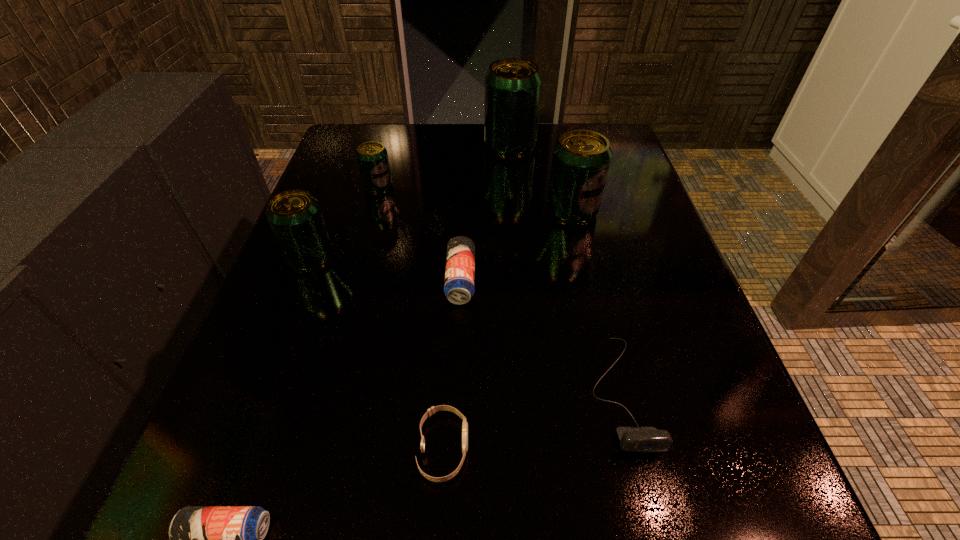
Identify the location of object located in the near edge section of the desktop. The width and height of the screenshot is (960, 540). (430, 412).

Image resolution: width=960 pixels, height=540 pixels. What are the coordinates of `beer can positioned at the right edge` in the screenshot? It's located at (x=581, y=158).

You are a GUI agent. You are given a task and a screenshot of the screen. Output one action in this format:
    pyautogui.click(x=<x>, y=<y>)
    Task: Click on the webcam that is at the right edge
    
    Given the screenshot: What is the action you would take?
    pyautogui.click(x=645, y=439)

Locate an element on the screen. This screenshot has height=540, width=960. free space at the far edge of the desktop is located at coordinates (407, 144).

Locate an element on the screen. Image resolution: width=960 pixels, height=540 pixels. blank space at the near edge of the desktop is located at coordinates (337, 491).

Where is `vacant space at the left edge of the desktop`? vacant space at the left edge of the desktop is located at coordinates (316, 347).

The height and width of the screenshot is (540, 960). I want to click on vacant space at the right edge, so click(616, 346).

At what (x,y) coordinates should I click in order to perform the action: click on vacant space at the far right corner. Please return your answer as a coordinate pair (x, y). Looking at the image, I should click on (583, 129).

You are a GUI agent. You are given a task and a screenshot of the screen. Output one action in this format:
    pyautogui.click(x=<x>, y=<y>)
    Task: Click on the vacant space at the near right corner of the desktop
    Image resolution: width=960 pixels, height=540 pixels.
    Given the screenshot: What is the action you would take?
    pyautogui.click(x=769, y=520)

What are the coordinates of `free space between the seventh nearest object and the webcam` in the screenshot? It's located at (498, 289).